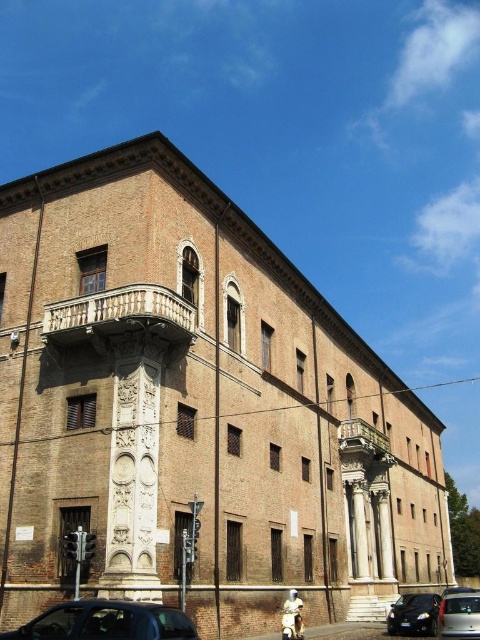
This screenshot has height=640, width=480. Describe the element at coordinates (414, 614) in the screenshot. I see `shiny black car at lower right` at that location.

Does shiny black car at lower right come behind metallic silver van at lower right?

Yes, shiny black car at lower right is further from the viewer.

Locate an element on the screen. Image resolution: width=480 pixels, height=640 pixels. shiny black car at lower right is located at coordinates (414, 614).

Find the location of `shiny black car at lower left`. shiny black car at lower left is located at coordinates (107, 621).

Find the location of a particular element. shiny black car at lower left is located at coordinates (107, 621).

Based on the photo, who is higher up, shiny black car at lower left or shiny black car at lower right?

Positioned higher is shiny black car at lower left.

Who is positioned more to the left, shiny black car at lower left or shiny black car at lower right?

shiny black car at lower left

The width and height of the screenshot is (480, 640). Find the location of `shiny black car at lower left`. shiny black car at lower left is located at coordinates (107, 621).